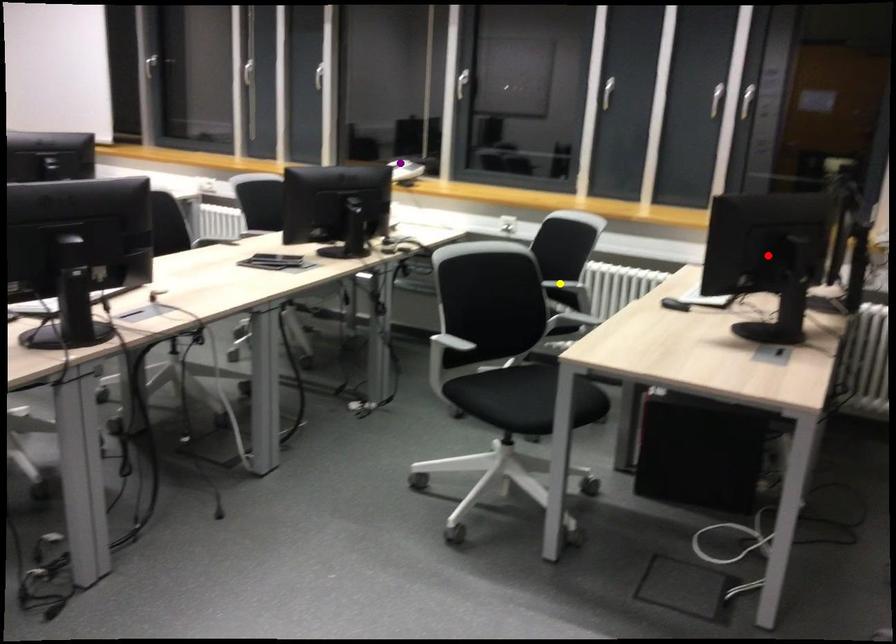
Looking at this image, order these from nearest to farthest:
red point, purple point, yellow point

red point → yellow point → purple point